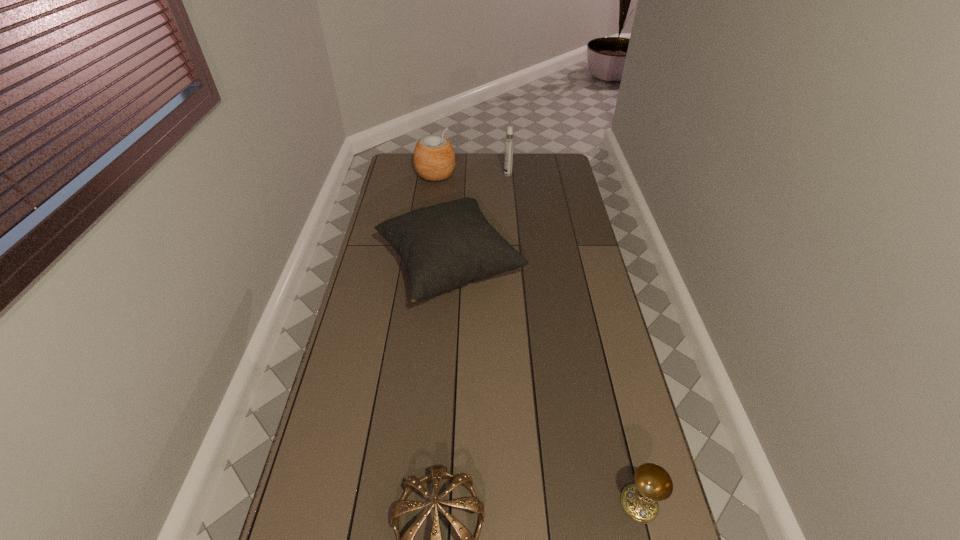
Find the location of `the second closest object to the chalice`. the second closest object to the chalice is located at coordinates (447, 245).

The height and width of the screenshot is (540, 960). I want to click on the fourth closest object relative to the rightmost object, so click(x=509, y=139).

In order to click on free space that satisfies the following two spatial constraints: 1. on the front side of the coconut; 2. on the right side of the aerosol can in this screenshot , I will do `click(436, 174)`.

Image resolution: width=960 pixels, height=540 pixels. I want to click on vacant space that satisfies the following two spatial constraints: 1. on the front side of the rightmost object; 2. on the left side of the third nearest object, so click(432, 504).